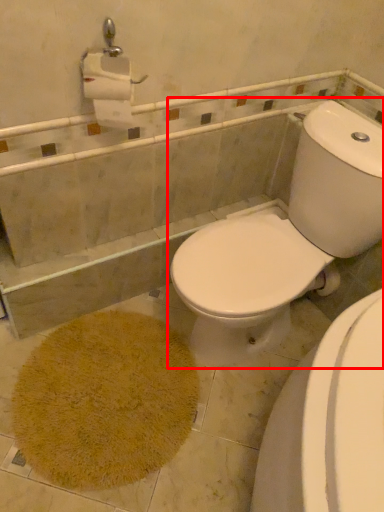
Question: Where is toilet (annotated by the red box) located in relation to bath mat in the image?

Choices:
 (A) left
 (B) right

Answer: (B)